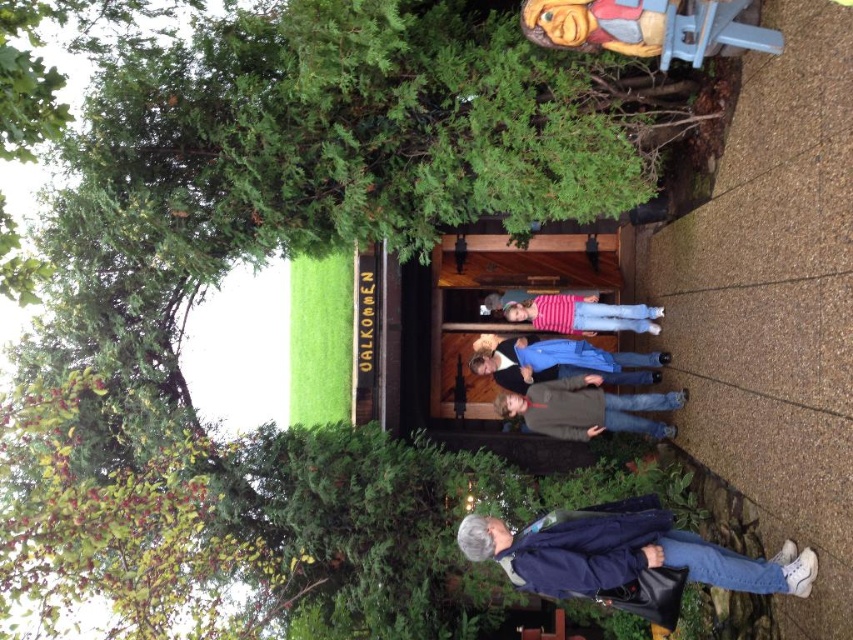
You are organizing a clothing drive and need to store jackets in boxes. You have two jackets in front of you, the dark blue jacket at lower right and the blue denim jacket at center. Which jacket requires a larger box for proper storage?

The dark blue jacket at lower right requires a larger box for proper storage because its width is greater than the blue denim jacket at center.